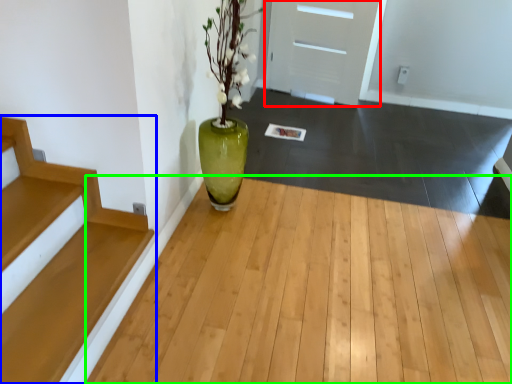
Question: Estimate the real-world distances between objects in this image. Which object is farther from door (highlighted by a red box), stairs (highlighted by a blue box) or corridor (highlighted by a green box)?

Choices:
 (A) stairs
 (B) corridor

Answer: (A)